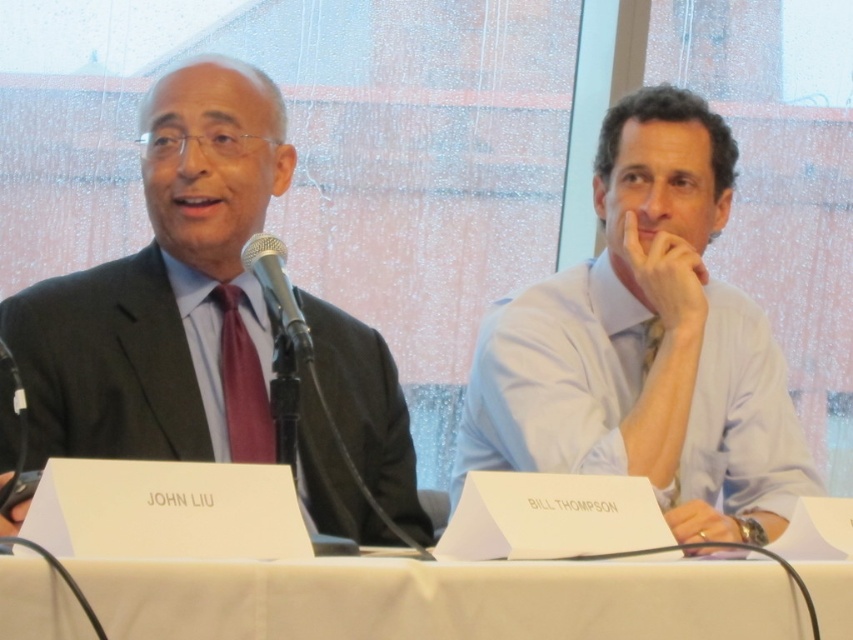
Between matte red tie at left and metallic silver microphone at center, which one has less height?

With less height is metallic silver microphone at center.

Is matte red tie at left positioned before metallic silver microphone at center?

No, matte red tie at left is further to the viewer.

I want to click on matte red tie at left, so click(242, 381).

Does matte black suit at left have a lesser width compared to metallic silver microphone at center?

No, matte black suit at left is not thinner than metallic silver microphone at center.

Can you confirm if matte black suit at left is smaller than metallic silver microphone at center?

Incorrect, matte black suit at left is not smaller in size than metallic silver microphone at center.

Which is in front, point (187, 227) or point (312, 348)?

Point (312, 348)

You are a GUI agent. You are given a task and a screenshot of the screen. Output one action in this format:
    pyautogui.click(x=<x>, y=<y>)
    Task: Click on the matte black suit at left
    The image size is (853, 640).
    Given the screenshot: What is the action you would take?
    pyautogui.click(x=167, y=291)

Does light blue shirt at right have a greater height compared to white paper at center?

Correct, light blue shirt at right is much taller as white paper at center.

Describe the element at coordinates (646, 346) in the screenshot. The width and height of the screenshot is (853, 640). I see `light blue shirt at right` at that location.

Locate an element on the screen. This screenshot has height=640, width=853. light blue shirt at right is located at coordinates (646, 346).